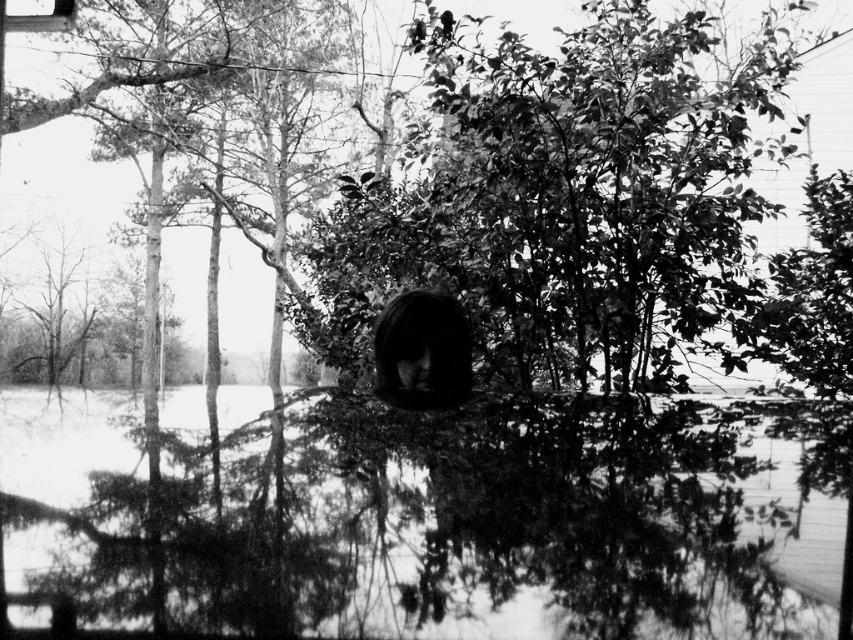
You are an artist trying to paint this scene. You notice the transparent glass puddle at center and the dark hair at center. Which object in the scene would require more detailed brushwork due to its size?

The transparent glass puddle at center requires more detailed brushwork because it has a larger size compared to the dark hair at center.